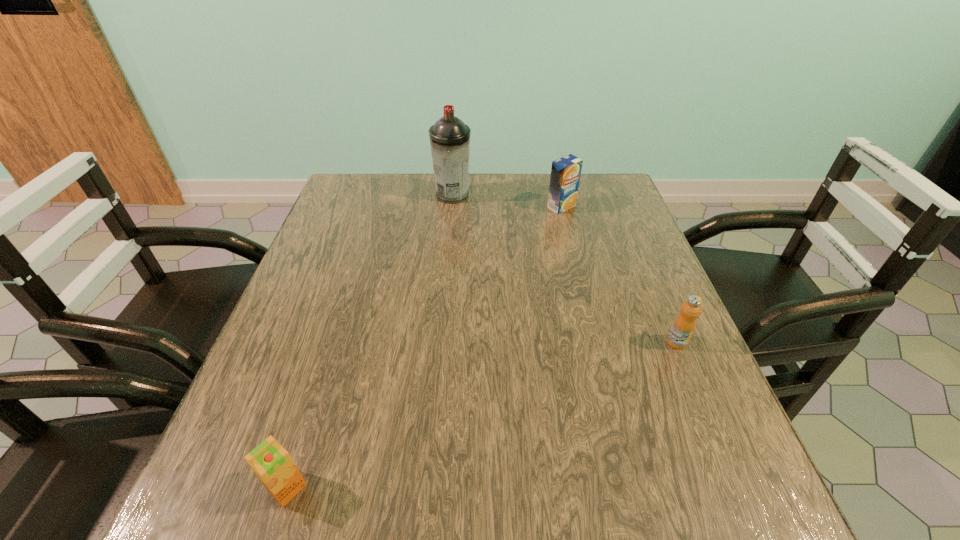
In the image, there is a desktop. Where is `vacant space at the right edge`? This screenshot has width=960, height=540. vacant space at the right edge is located at coordinates (708, 458).

Image resolution: width=960 pixels, height=540 pixels. I want to click on vacant position at the far left corner of the desktop, so click(x=342, y=197).

In the image, there is a desktop. At what (x,y) coordinates should I click in order to perform the action: click on free space at the far right corner. Please return your answer as a coordinate pair (x, y). The image size is (960, 540). Looking at the image, I should click on (592, 194).

In order to click on vacant area between the tallest orange juice and the rightmost orange juice in this screenshot , I will do `click(619, 274)`.

In order to click on vacant area that lies between the farthest orange juice and the rightmost orange juice in this screenshot , I will do `click(619, 274)`.

Locate an element on the screen. free spot between the leftmost object and the farthest orange juice is located at coordinates (424, 347).

Where is `empty space between the rightmost orange juice and the nearest object`? The width and height of the screenshot is (960, 540). empty space between the rightmost orange juice and the nearest object is located at coordinates (482, 415).

At what (x,y) coordinates should I click in order to perform the action: click on free space between the tallest orange juice and the second object from left to right. Please return your answer as a coordinate pair (x, y). The image size is (960, 540). Looking at the image, I should click on (507, 201).

Locate an element on the screen. This screenshot has height=540, width=960. free spot between the aerosol can and the tallest orange juice is located at coordinates (507, 201).

Where is `blank region between the second object from left to right and the leftmost object`? blank region between the second object from left to right and the leftmost object is located at coordinates (370, 341).